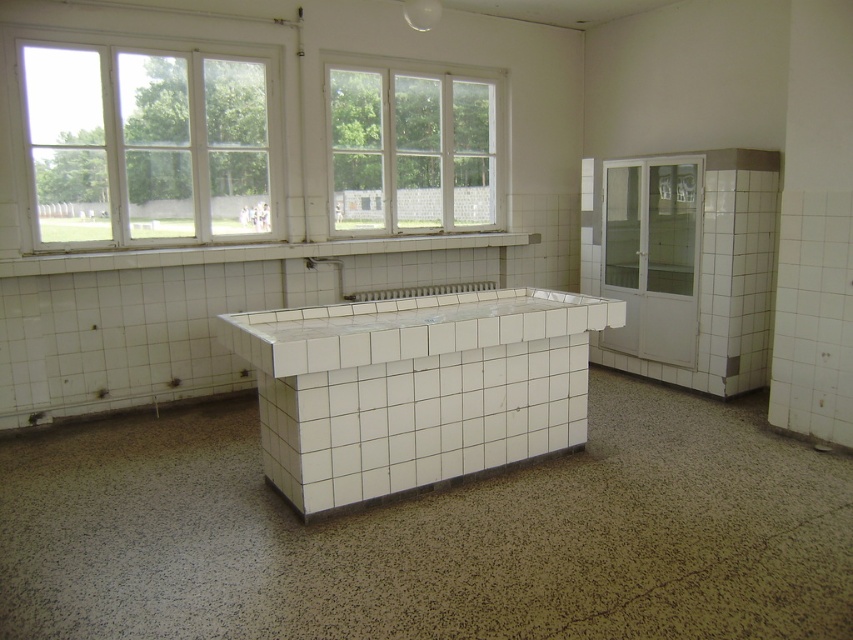
Question: Which object is positioned closest to the clear glass window at upper left?

Choices:
 (A) white tile counter at center
 (B) white glass window at upper center

Answer: (B)

Question: Is white tile counter at center below white glossy counter top at center?

Choices:
 (A) yes
 (B) no

Answer: (A)

Question: Which of the following is the closest to the observer?

Choices:
 (A) white glass window at upper center
 (B) clear glass window at upper left

Answer: (B)

Question: Can you confirm if white glass window at upper center is positioned above white glossy counter top at center?

Choices:
 (A) no
 (B) yes

Answer: (B)

Question: In this image, where is clear glass window at upper left located relative to white glossy counter top at center?

Choices:
 (A) right
 (B) left

Answer: (B)

Question: Among these objects, which one is farthest from the camera?

Choices:
 (A) white glossy counter top at center
 (B) white tile counter at center
 (C) white glass window at upper center

Answer: (C)